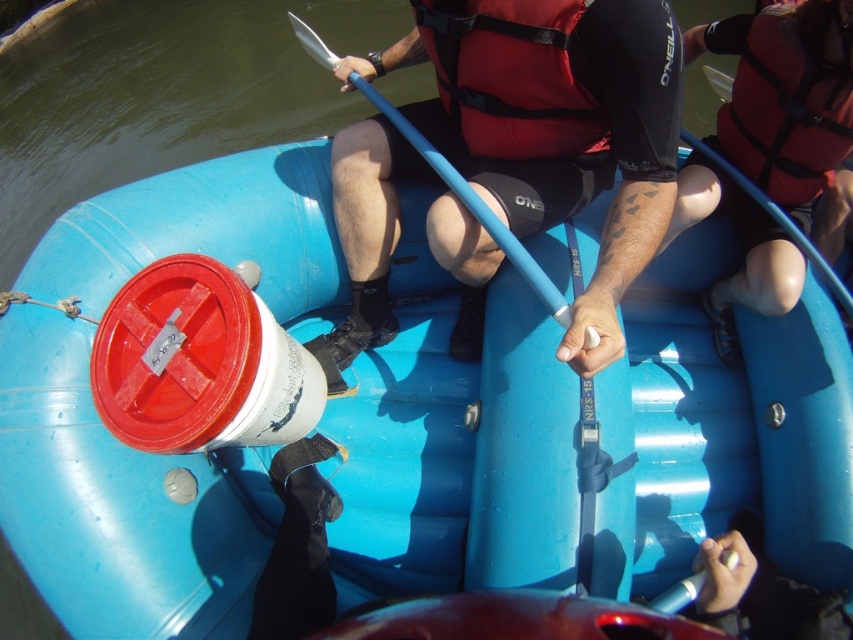
You are a safety inspector checking the rafting equipment. You notice a point marked at coordinates (511, 76) on the raft. According to the safety guidelines, the red nylon life jacket must be placed at the center of the raft for easy access. Is the life jacket correctly positioned?

Yes, the red nylon life jacket at center is correctly positioned because the point (511, 76) marks its location at the center of the raft as required by safety guidelines.

You are a photographer trying to capture the red life vest at upper right and the red nylon life jacket at upper right in the same frame. Which one is on the left side?

The red life vest at upper right is positioned on the left side of the red nylon life jacket at upper right.